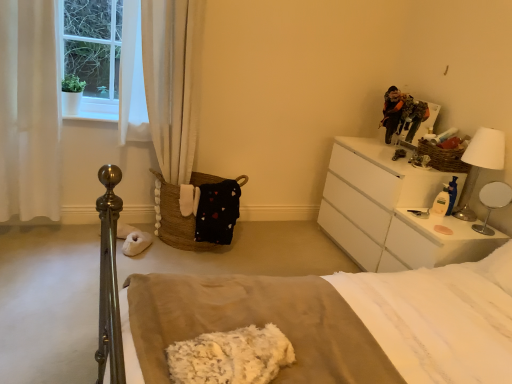
Question: Is woven brown basket at upper right, which ranks as the second basket in bottom-to-top order, in front of white fabric curtain at left, which is counted as the first curtain, starting from the left?

Choices:
 (A) yes
 (B) no

Answer: (B)

Question: Is woven brown basket at upper right, placed as the 1th basket when sorted from right to left, turned away from white fabric curtain at left, which is counted as the 2th curtain, starting from the right?

Choices:
 (A) yes
 (B) no

Answer: (B)

Question: From a real-world perspective, is woven brown basket at upper right, marked as the 2th basket in a left-to-right arrangement, located beneath white fabric curtain at left, which is counted as the first curtain, starting from the left?

Choices:
 (A) no
 (B) yes

Answer: (A)

Question: Is woven brown basket at upper right, which ranks as the second basket in bottom-to-top order, thinner than white fabric curtain at left, which is counted as the 2th curtain, starting from the right?

Choices:
 (A) no
 (B) yes

Answer: (B)

Question: Is woven brown basket at upper right, which is counted as the 1th basket, starting from the top, surrounding white fabric curtain at left, which is counted as the 2th curtain, starting from the right?

Choices:
 (A) yes
 (B) no

Answer: (B)

Question: Is woven brown basket at upper right, placed as the 1th basket when sorted from right to left, wider than white fabric curtain at left, which is counted as the 2th curtain, starting from the right?

Choices:
 (A) yes
 (B) no

Answer: (B)

Question: Considering the relative sizes of white fabric curtain at left, which is the second curtain from left to right, and white glossy nightstand at upper right in the image provided, is white fabric curtain at left, which is the second curtain from left to right, smaller than white glossy nightstand at upper right?

Choices:
 (A) no
 (B) yes

Answer: (B)

Question: From the image's perspective, is white fabric curtain at left, which is counted as the first curtain, starting from the right, beneath white glossy nightstand at upper right?

Choices:
 (A) no
 (B) yes

Answer: (A)

Question: Is white fabric curtain at left, which is the second curtain from left to right, with white glossy nightstand at upper right?

Choices:
 (A) no
 (B) yes

Answer: (A)

Question: Does white fabric curtain at left, which is the second curtain from left to right, have a lesser width compared to white glossy nightstand at upper right?

Choices:
 (A) yes
 (B) no

Answer: (A)

Question: From a real-world perspective, is white fabric curtain at left, which is the second curtain from left to right, physically below white glossy nightstand at upper right?

Choices:
 (A) no
 (B) yes

Answer: (A)

Question: Can we say white fabric curtain at left, which is counted as the first curtain, starting from the right, lies outside white glossy nightstand at upper right?

Choices:
 (A) no
 (B) yes

Answer: (B)

Question: Would you consider white glossy table lamp at right, placed as the second table lamp when sorted from top to bottom, to be distant from white fluffy blanket at center?

Choices:
 (A) yes
 (B) no

Answer: (A)